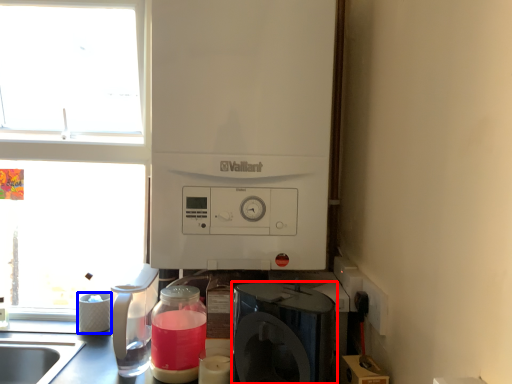
Question: Which point is further to the camera, home appliance (highlighted by a red box) or appliance (highlighted by a blue box)?

Choices:
 (A) home appliance
 (B) appliance

Answer: (B)